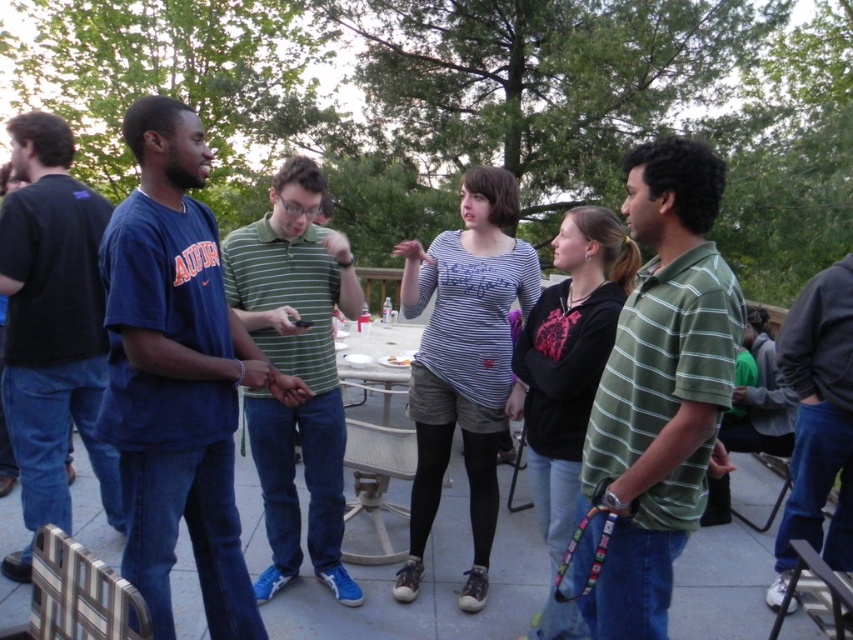
Question: Does green striped polo shirt at right come in front of white matte plate at center?

Choices:
 (A) yes
 (B) no

Answer: (A)

Question: Which is farther from the dark gray hoodie at right?

Choices:
 (A) green striped polo shirt at center
 (B) white matte plate at center
 (C) metallic silver table at center
 (D) dark blue t-shirt at left

Answer: (D)

Question: Is dark gray hoodie at right wider than metallic silver picnic table at center?

Choices:
 (A) no
 (B) yes

Answer: (A)

Question: Can you confirm if green striped polo shirt at center is positioned to the left of dark gray hoodie at right?

Choices:
 (A) yes
 (B) no

Answer: (A)

Question: Which point is closer to the camera?

Choices:
 (A) dark gray hoodie at right
 (B) white matte plate at center
 (C) matte blue t-shirt at center
 (D) green striped polo shirt at right

Answer: (D)

Question: Which point is farther from the camera taking this photo?

Choices:
 (A) (340, 566)
 (B) (735, 301)
 (C) (399, 356)
 (D) (194, 166)

Answer: (C)